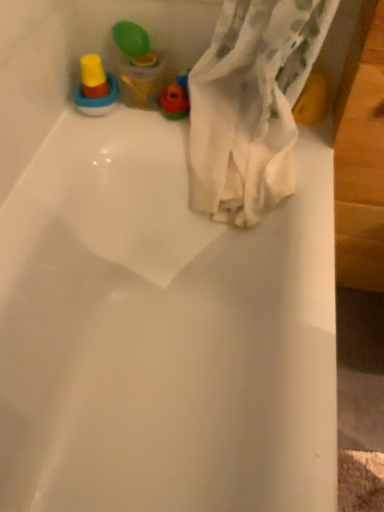
Describe the element at coordinates (96, 88) in the screenshot. I see `yellow rubber baby bottle at upper left` at that location.

Locate an element on the screen. yellow rubber baby bottle at upper left is located at coordinates (96, 88).

Find the location of a particular element. The width and height of the screenshot is (384, 512). yellow rubber baby bottle at upper left is located at coordinates (96, 88).